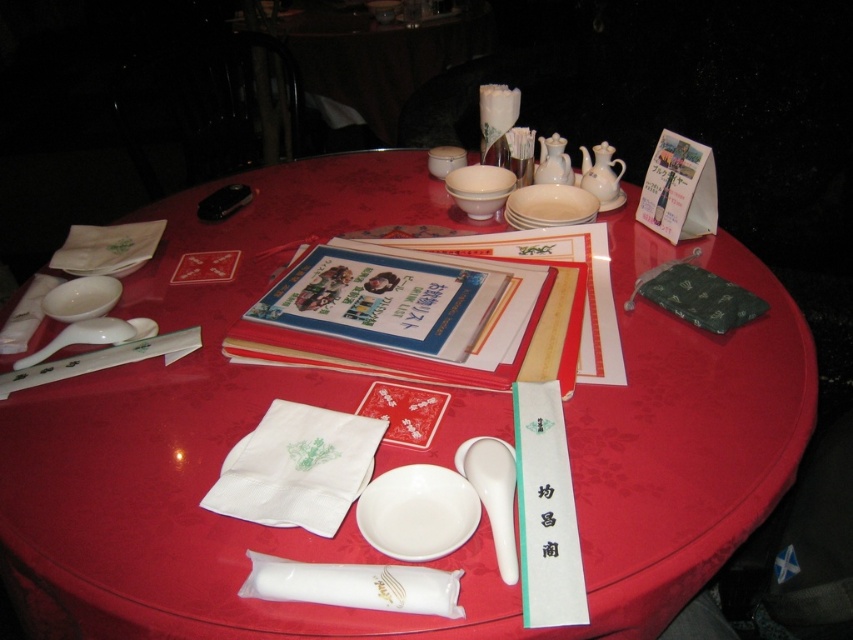
Question: Which point is farther to the camera?

Choices:
 (A) white fabric at center
 (B) white ceramic teapot at upper right

Answer: (B)

Question: Does white porcelain spoon at upper left have a greater width compared to white ceramic bowl at upper center?

Choices:
 (A) yes
 (B) no

Answer: (A)

Question: Which object is positioned farthest from the white glossy bowl at upper left?

Choices:
 (A) white porcelain bowls at center
 (B) white ceramic spoon at center

Answer: (B)

Question: Can you confirm if white glossy bowl at upper left is smaller than translucent plastic toothpicks at center?

Choices:
 (A) yes
 (B) no

Answer: (B)

Question: Among these objects, which one is nearest to the camera?

Choices:
 (A) white porcelain spoon at upper left
 (B) white ceramic teapot at upper right

Answer: (A)

Question: Where is white ceramic spoon at center located in relation to white ceramic bowl at upper center in the image?

Choices:
 (A) below
 (B) above

Answer: (A)